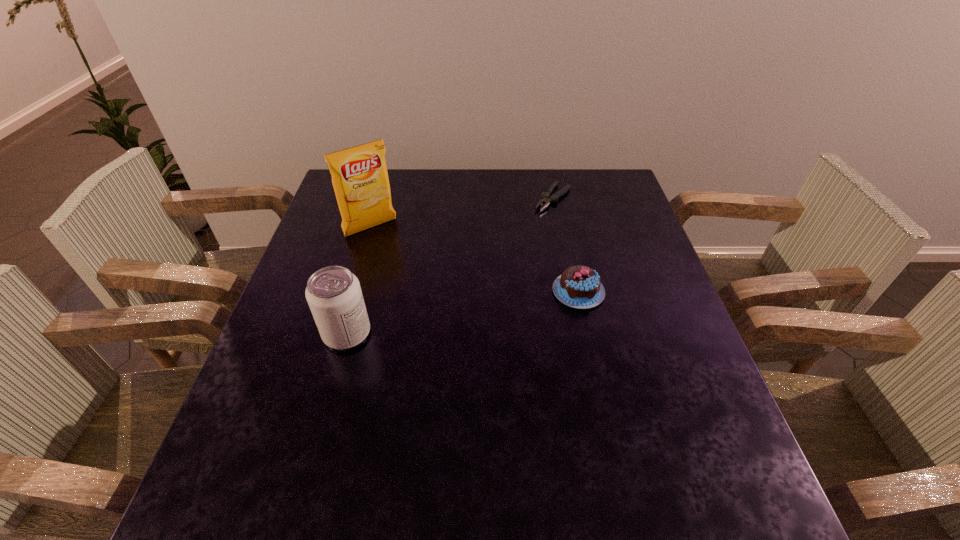
The width and height of the screenshot is (960, 540). I want to click on empty space between the third nearest object and the second nearest object, so click(474, 260).

Locate an element on the screen. The height and width of the screenshot is (540, 960). vacant region between the tallest object and the chocolate cake is located at coordinates (474, 260).

Image resolution: width=960 pixels, height=540 pixels. In order to click on free area in between the second farthest object and the farthest object in this screenshot , I will do `click(462, 213)`.

You are a GUI agent. You are given a task and a screenshot of the screen. Output one action in this format:
    pyautogui.click(x=<x>, y=<y>)
    Task: Click on the empty space between the pliers and the third farthest object
    The image size is (960, 540).
    Given the screenshot: What is the action you would take?
    pyautogui.click(x=565, y=245)

The height and width of the screenshot is (540, 960). What are the coordinates of `free space between the third shortest object and the second nearest object` in the screenshot? It's located at (463, 313).

You are a GUI agent. You are given a task and a screenshot of the screen. Output one action in this format:
    pyautogui.click(x=<x>, y=<y>)
    Task: Click on the free space between the third nearest object and the third tallest object
    This screenshot has width=960, height=540.
    Given the screenshot: What is the action you would take?
    pyautogui.click(x=474, y=260)

This screenshot has height=540, width=960. Find the location of `the closest object relative to the second tallest object`. the closest object relative to the second tallest object is located at coordinates (360, 179).

Select which object is the closest to the crisp (potato chip). Please provide its 2D coordinates. Your answer should be formatted as a tuple, i.e. [(x, y)], where the tuple contains the x and y coordinates of a point satisfying the conditions above.

[(333, 293)]

Identify the location of free space that satisfies the following two spatial constraints: 1. on the front side of the soda can; 2. on the left side of the tallest object. Image resolution: width=960 pixels, height=540 pixels. (340, 334).

Locate an element on the screen. free space that satisfies the following two spatial constraints: 1. on the back side of the soda can; 2. on the right side of the farthest object is located at coordinates (384, 198).